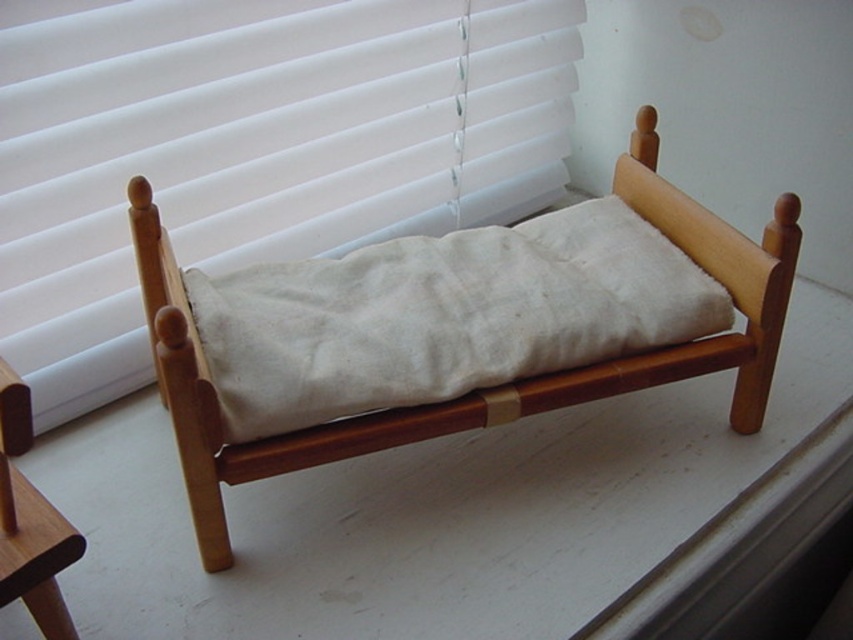
You are trying to hang a decorative banner that is 1.2 meters wide between the white fabric blinds at upper center and the white cotton pillow at center. Based on the scene description, can the banner fit horizontally between them?

The white fabric blinds at upper center might be wider than the white cotton pillow at center, so the banner might fit if the distance between them is sufficient. However, the exact width isn t specified, so it s uncertain.

You are standing in front of the bed and looking towards the window. There is a point at coordinates [251,148]. What object is located at that point?

The point at [251,148] is occupied by the white fabric blinds at upper center.